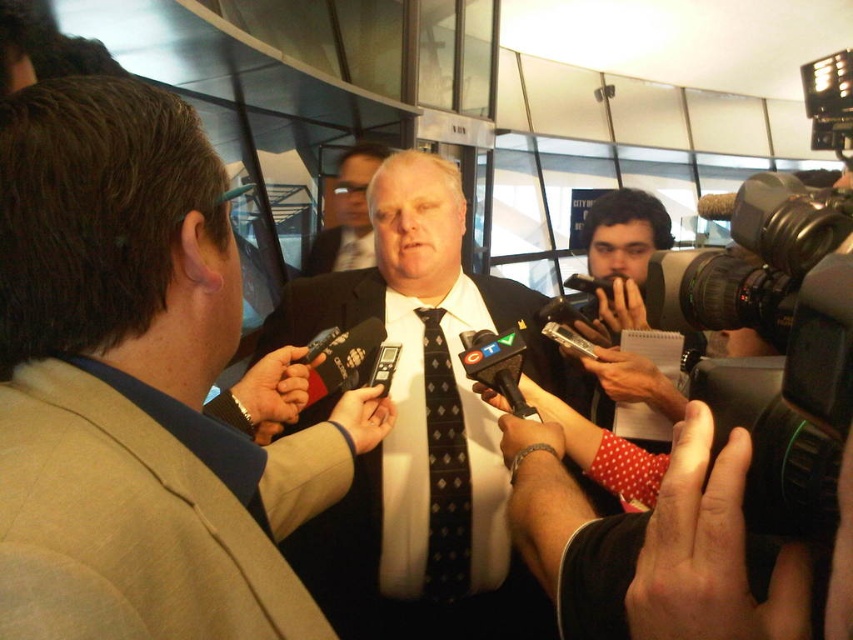
Question: Is dark blue textured suit at center above matte black tie at center?

Choices:
 (A) no
 (B) yes

Answer: (A)

Question: Can you confirm if dark blue textured suit at center is thinner than matte black tie at center?

Choices:
 (A) yes
 (B) no

Answer: (B)

Question: Estimate the real-world distances between objects in this image. Which object is farther from the tan fabric suit at left?

Choices:
 (A) light brown suit at center
 (B) matte black tie at center
 (C) dark blue textured suit at center
 (D) black dotted tie at center

Answer: (B)

Question: Estimate the real-world distances between objects in this image. Which object is closer to the dark blue textured suit at center?

Choices:
 (A) matte black tie at center
 (B) light brown suit at center
 (C) black dotted tie at center
 (D) tan fabric suit at left

Answer: (C)

Question: Which is nearer to the matte black tie at center?

Choices:
 (A) dark blue textured suit at center
 (B) tan fabric suit at left
 (C) black dotted tie at center

Answer: (A)

Question: In this image, where is black dotted tie at center located relative to matte black tie at center?

Choices:
 (A) right
 (B) left

Answer: (A)